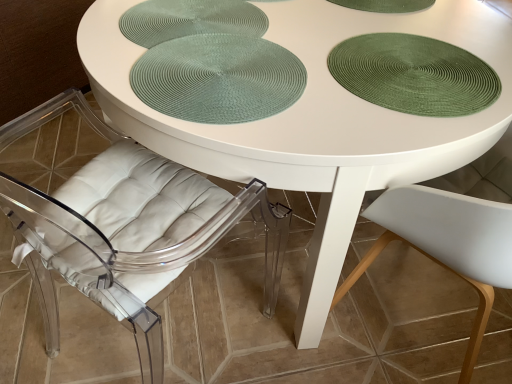
Where is `vacant space that is to the left of green woven placemat at center`? vacant space that is to the left of green woven placemat at center is located at coordinates (115, 48).